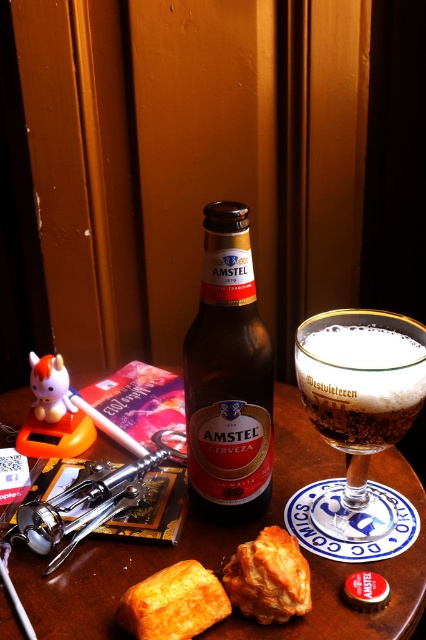
You are at the bar and want to place a small coaster at the point marked as point (163, 547) on the wooden table at center. Is this point on the table?

Yes, the point (163, 547) is on the wooden table at center, so placing the coaster there is possible.

You are a guest at this cozy indoor setting and want to place a small ornament on the wooden table at center. However, there is an amber glass bottle at center in the way. Can you place the ornament on the table without moving the bottle?

The wooden table at center is located below the amber glass bottle at center, meaning the bottle is on top of the table. Therefore, you can place the ornament on the table next to the bottle without needing to move it.

You are a guest at a cozy indoor event and see the wooden table at center and the golden crispy pastry at center. Which object is positioned to the right side?

The golden crispy pastry at center is positioned to the right of the wooden table at center.